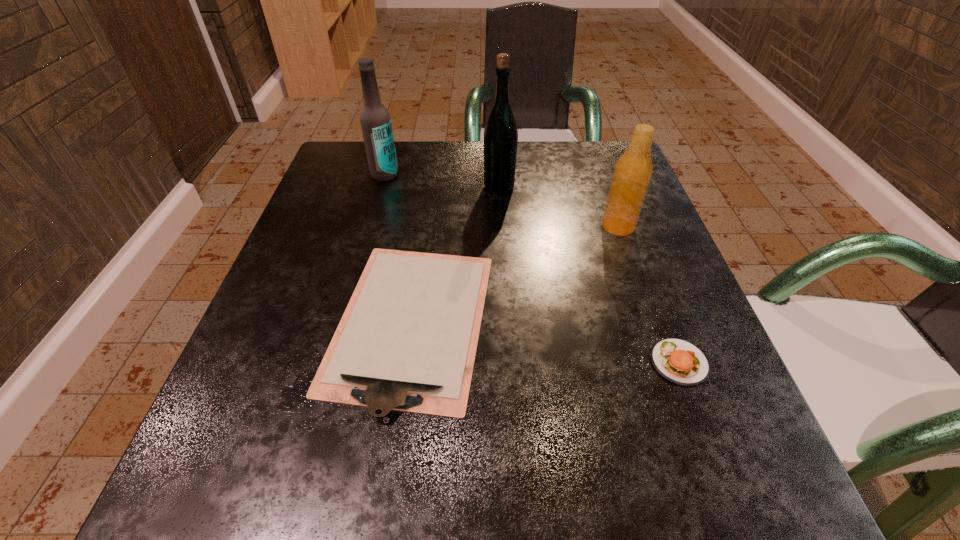
Find the location of `vacant space located on the right of the clipboard`. vacant space located on the right of the clipboard is located at coordinates (652, 322).

The height and width of the screenshot is (540, 960). I want to click on beer bottle located at the left edge, so click(375, 120).

Identify the location of clipboard positioned at the left edge. click(x=407, y=341).

Where is `beer bottle at the right edge`? beer bottle at the right edge is located at coordinates (632, 173).

Locate an element on the screen. patty that is at the right edge is located at coordinates (678, 361).

Where is `object that is at the far left corner`? The width and height of the screenshot is (960, 540). object that is at the far left corner is located at coordinates (375, 120).

At what (x,y) coordinates should I click in order to perform the action: click on vacant space at the far edge of the desktop. Please return your answer as a coordinate pair (x, y). The height and width of the screenshot is (540, 960). Looking at the image, I should click on (467, 180).

Locate an element on the screen. The width and height of the screenshot is (960, 540). blank space at the near edge of the desktop is located at coordinates (541, 511).

The height and width of the screenshot is (540, 960). In the image, there is a desktop. What are the coordinates of `vacant space at the left edge` in the screenshot? It's located at (251, 343).

Find the location of a particular element. This screenshot has width=960, height=540. vacant space at the right edge is located at coordinates (727, 423).